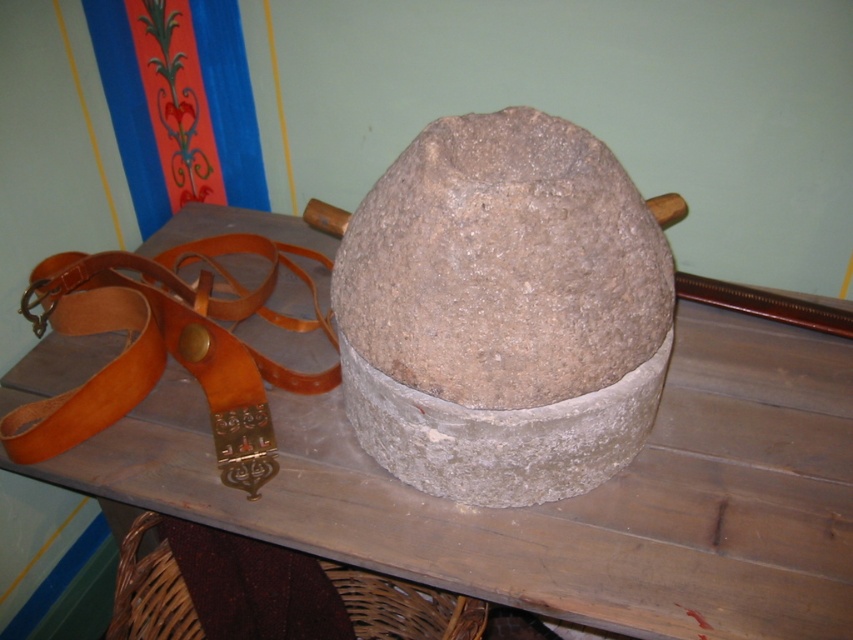
You are setting up a display in a museum and need to place both the smooth wooden table at center and the gray rough stone at center. According to the scene, which object is located above the other?

The gray rough stone at center is above the smooth wooden table at center because the smooth wooden table at center is positioned under it.

In the scene shown: You are standing in front of the rustic setting described. Where exactly is the gray rough stone at center located in terms of coordinates?

The gray rough stone at center is located at coordinates point (x=503, y=264).

You are standing in the scene and want to place a small vase on the smooth wooden table at center. Based on the 2D coordinates provided, can you confirm if the table is positioned towards the upper or lower half of the image?

The 2D location of smooth wooden table at center is at point (561, 500). Since the y coordinate is 0.660, which is above 0.5, the table is positioned in the upper half of the image.